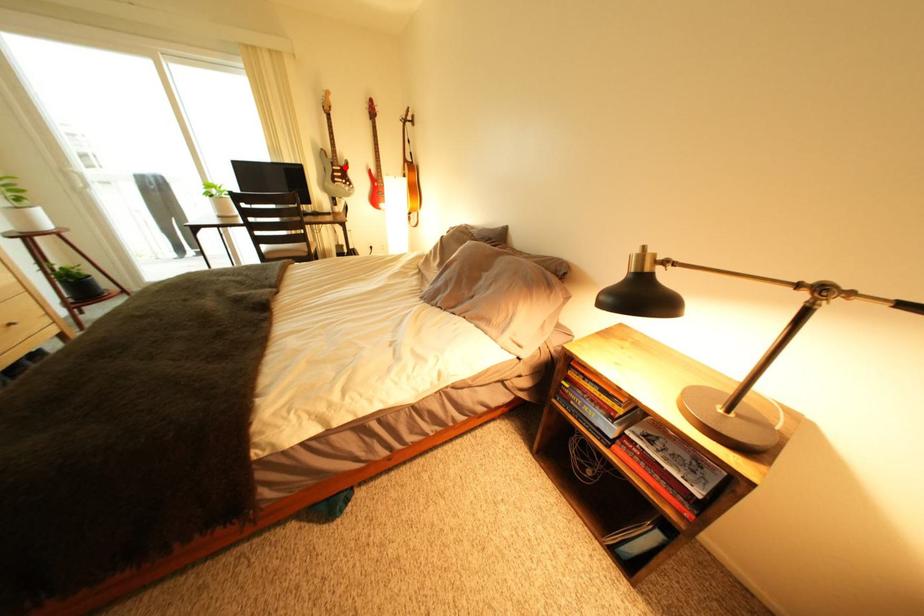
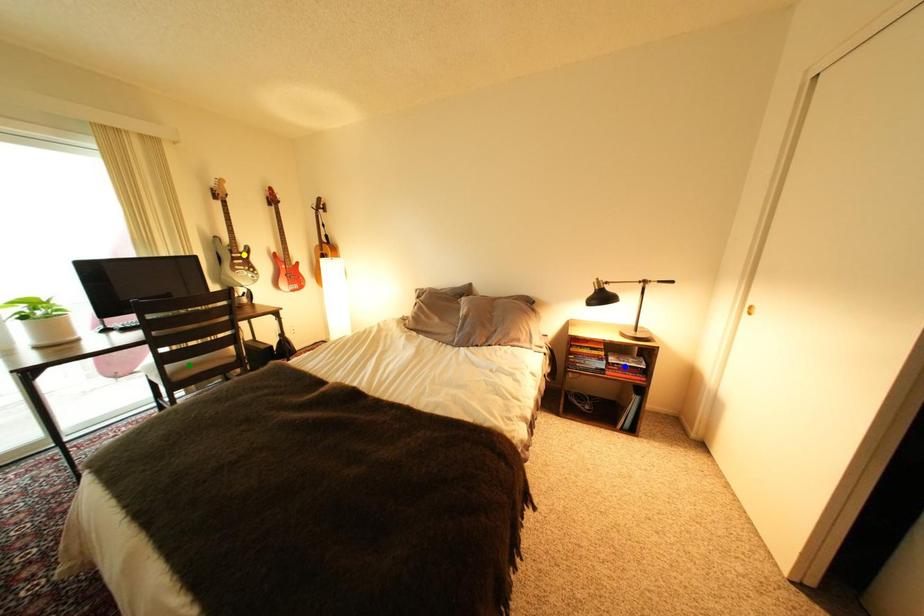
Question: I am providing you with two images of the same scene from different viewpoints. A red point is marked on the first image. You are given multiple points on the second image. Which point in image 2 represents the same 3d spot as the red point in image 1?

Choices:
 (A) green point
 (B) blue point
 (C) yellow point

Answer: (C)